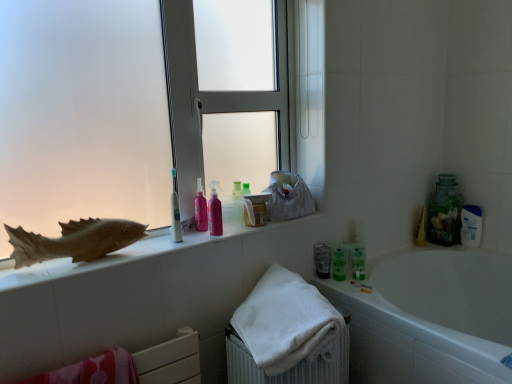
The height and width of the screenshot is (384, 512). Identify the location of vacant space in front of green matte mouthwash at lower right, marked as the 3th mouthwash in a left-to-right arrangement. click(352, 286).